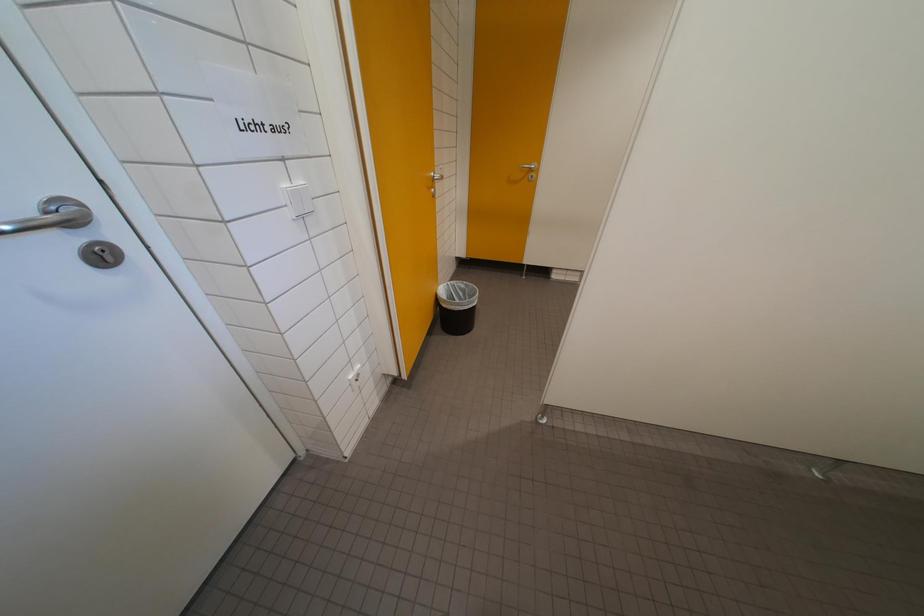
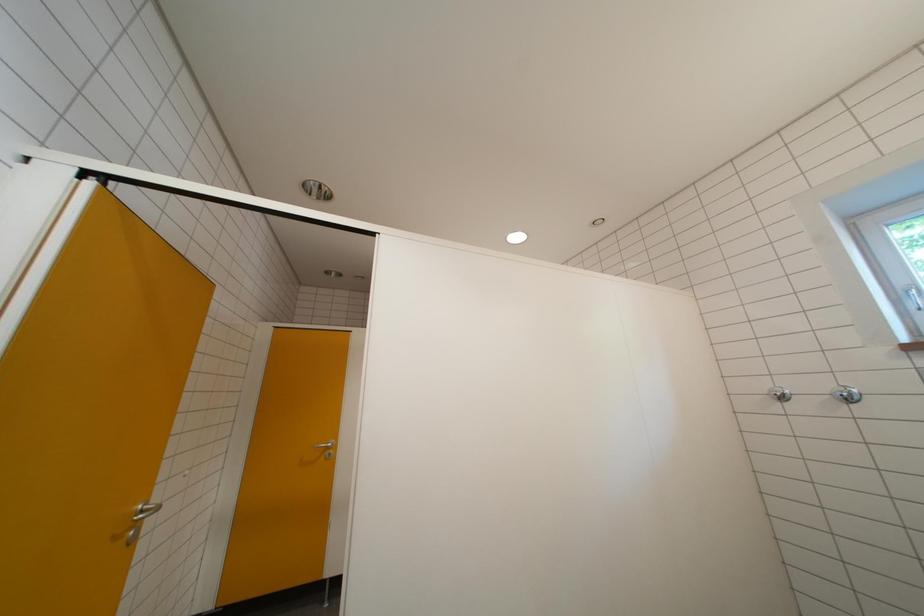
Looking at this image, how did the camera likely rotate?

The camera's rotation is toward right-up.